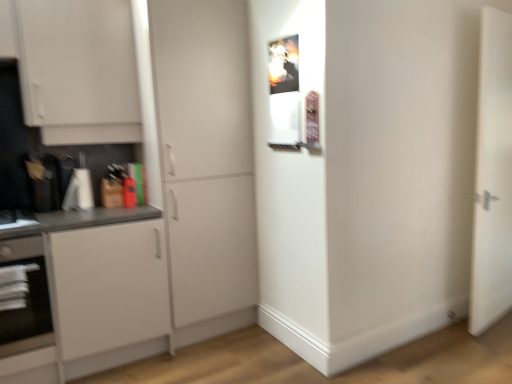
Describe the element at coordinates (493, 176) in the screenshot. I see `white matte door at right, arranged as the first door when viewed from the right` at that location.

This screenshot has width=512, height=384. Describe the element at coordinates (101, 284) in the screenshot. I see `white matte cabinet at left` at that location.

How much space does white matte cabinet at center, marked as the 1th door in a left-to-right arrangement, occupy vertically?

white matte cabinet at center, marked as the 1th door in a left-to-right arrangement, is 2.13 meters in height.

Measure the distance between black glass oven at lower left and camera.

black glass oven at lower left and camera are 2.03 meters apart.

Image resolution: width=512 pixels, height=384 pixels. Find the location of `white matte door at right, arranged as the first door when viewed from the right`. white matte door at right, arranged as the first door when viewed from the right is located at coordinates (493, 176).

Is white matte cabinet at center, marked as the 1th door in a left-to-right arrangement, completely or partially outside of white matte cabinet at left?

Indeed, white matte cabinet at center, marked as the 1th door in a left-to-right arrangement, is completely outside white matte cabinet at left.

From their relative heights in the image, would you say white matte cabinet at center, marked as the 1th door in a left-to-right arrangement, is taller or shorter than white matte cabinet at left?

Clearly, white matte cabinet at center, marked as the 1th door in a left-to-right arrangement, is taller compared to white matte cabinet at left.

Is white matte cabinet at center, arranged as the 2th door when viewed from the right, aimed at white matte cabinet at left?

No, white matte cabinet at center, arranged as the 2th door when viewed from the right, is not aimed at white matte cabinet at left.

What's the angular difference between white matte cabinet at center, arranged as the 2th door when viewed from the right, and white matte cabinet at left's facing directions?

2.32 degrees.

Is white matte cabinet at left at the left side of white matte door at right, which appears as the 2th door when viewed from the left?

Yes.

Does white matte cabinet at left have a smaller size compared to white matte door at right, which appears as the 2th door when viewed from the left?

No, white matte cabinet at left is not smaller than white matte door at right, which appears as the 2th door when viewed from the left.

From the picture: Is white matte cabinet at left positioned with its back to white matte door at right, which appears as the 2th door when viewed from the left?

white matte cabinet at left does not have its back to white matte door at right, which appears as the 2th door when viewed from the left.

From a real-world perspective, is white matte cabinet at left on white matte door at right, arranged as the first door when viewed from the right?

Incorrect, from a real-world perspective, white matte cabinet at left is lower than white matte door at right, arranged as the first door when viewed from the right.

Can you confirm if white matte cabinet at left is bigger than black glass oven at lower left?

Correct, white matte cabinet at left is larger in size than black glass oven at lower left.

Locate an element on the screen. cabinetry that appears below the black glass oven at lower left (from the image's perspective) is located at coordinates (101, 284).

Is white matte cabinet at left surrounding black glass oven at lower left?

Yes, white matte cabinet at left is surrounding black glass oven at lower left.

Based on their sizes in the image, would you say white matte cabinet at center, marked as the 1th door in a left-to-right arrangement, is bigger or smaller than black glass oven at lower left?

white matte cabinet at center, marked as the 1th door in a left-to-right arrangement, is bigger than black glass oven at lower left.

How many degrees apart are the facing directions of white matte cabinet at center, marked as the 1th door in a left-to-right arrangement, and black glass oven at lower left?

The angle between the facing direction of white matte cabinet at center, marked as the 1th door in a left-to-right arrangement, and the facing direction of black glass oven at lower left is 2.32 degrees.

Considering the positions of objects white matte cabinet at center, arranged as the 2th door when viewed from the right, and black glass oven at lower left in the image provided, who is more to the left, white matte cabinet at center, arranged as the 2th door when viewed from the right, or black glass oven at lower left?

Positioned to the left is black glass oven at lower left.

From the image's perspective, which object appears higher, white matte cabinet at center, arranged as the 2th door when viewed from the right, or black glass oven at lower left?

white matte cabinet at center, arranged as the 2th door when viewed from the right, is shown above in the image.

Can you tell me how much white matte cabinet at left and white matte cabinet at center, arranged as the 2th door when viewed from the right, differ in facing direction?

The angular difference between white matte cabinet at left and white matte cabinet at center, arranged as the 2th door when viewed from the right, is 2.32 degrees.

Between white matte cabinet at left and white matte cabinet at center, marked as the 1th door in a left-to-right arrangement, which one is positioned behind?

white matte cabinet at center, marked as the 1th door in a left-to-right arrangement, is further away from the camera.

Is white matte cabinet at left not within white matte cabinet at center, arranged as the 2th door when viewed from the right?

That's correct, white matte cabinet at left is outside of white matte cabinet at center, arranged as the 2th door when viewed from the right.

Considering the sizes of objects white matte door at right, arranged as the first door when viewed from the right, and white matte cabinet at center, arranged as the 2th door when viewed from the right, in the image provided, who is taller, white matte door at right, arranged as the first door when viewed from the right, or white matte cabinet at center, arranged as the 2th door when viewed from the right,?

white matte cabinet at center, arranged as the 2th door when viewed from the right.

From the image's perspective, which one is positioned lower, white matte door at right, which appears as the 2th door when viewed from the left, or white matte cabinet at center, arranged as the 2th door when viewed from the right?

white matte door at right, which appears as the 2th door when viewed from the left.

Would you say white matte door at right, arranged as the first door when viewed from the right, is outside white matte cabinet at center, arranged as the 2th door when viewed from the right?

white matte door at right, arranged as the first door when viewed from the right, lies outside white matte cabinet at center, arranged as the 2th door when viewed from the right,'s area.

Can you confirm if white matte door at right, arranged as the first door when viewed from the right, is smaller than white matte cabinet at center, arranged as the 2th door when viewed from the right?

Yes.

From the image's perspective, which is above, black glass oven at lower left or white matte door at right, arranged as the first door when viewed from the right?

From the image's view, white matte door at right, arranged as the first door when viewed from the right, is above.

Which is in front, point (48, 299) or point (509, 272)?

The point (48, 299) is more forward.

In the scene shown: Considering the sizes of black glass oven at lower left and white matte door at right, which appears as the 2th door when viewed from the left, in the image, is black glass oven at lower left taller or shorter than white matte door at right, which appears as the 2th door when viewed from the left,?

In the image, black glass oven at lower left appears to be shorter than white matte door at right, which appears as the 2th door when viewed from the left.

Based on the photo, which of these two, black glass oven at lower left or white matte door at right, arranged as the first door when viewed from the right, is wider?

With larger width is black glass oven at lower left.

What are the coordinates of `cabinetry that is on the left side of white matte cabinet at center, arranged as the 2th door when viewed from the right` in the screenshot? It's located at (101, 284).

From the image's perspective, starting from the white matte cabinet at left, which door is the 1st one above? Please provide its 2D coordinates.

[(493, 176)]

Estimate the real-world distances between objects in this image. Which object is closer to black glass oven at lower left, white matte cabinet at center, marked as the 1th door in a left-to-right arrangement, or white matte cabinet at left?

Based on the image, white matte cabinet at left appears to be nearer to black glass oven at lower left.

Looking at the image, which one is located closer to black glass oven at lower left, white matte cabinet at center, marked as the 1th door in a left-to-right arrangement, or white matte door at right, arranged as the first door when viewed from the right?

The object closer to black glass oven at lower left is white matte cabinet at center, marked as the 1th door in a left-to-right arrangement.

Based on their spatial positions, is black glass oven at lower left or white matte door at right, arranged as the first door when viewed from the right, closer to white matte cabinet at left?

The object closer to white matte cabinet at left is black glass oven at lower left.

When comparing their distances from white matte cabinet at left, does white matte cabinet at center, marked as the 1th door in a left-to-right arrangement, or black glass oven at lower left seem further?

white matte cabinet at center, marked as the 1th door in a left-to-right arrangement, is positioned further to the anchor white matte cabinet at left.

From the image, which object appears to be farther from white matte cabinet at center, arranged as the 2th door when viewed from the right, white matte door at right, arranged as the first door when viewed from the right, or black glass oven at lower left?

Based on the image, white matte door at right, arranged as the first door when viewed from the right, appears to be further to white matte cabinet at center, arranged as the 2th door when viewed from the right.

Looking at this image, when comparing their distances from white matte cabinet at center, marked as the 1th door in a left-to-right arrangement, does white matte door at right, which appears as the 2th door when viewed from the left, or white matte cabinet at left seem further?

white matte door at right, which appears as the 2th door when viewed from the left, lies further to white matte cabinet at center, marked as the 1th door in a left-to-right arrangement, than the other object.

When comparing their distances from white matte door at right, arranged as the first door when viewed from the right, does white matte cabinet at center, arranged as the 2th door when viewed from the right, or black glass oven at lower left seem closer?

The object closer to white matte door at right, arranged as the first door when viewed from the right, is white matte cabinet at center, arranged as the 2th door when viewed from the right.

In the scene shown: Which object lies nearer to the anchor point white matte cabinet at center, arranged as the 2th door when viewed from the right, black glass oven at lower left or white matte door at right, which appears as the 2th door when viewed from the left?

The object closer to white matte cabinet at center, arranged as the 2th door when viewed from the right, is black glass oven at lower left.

You are a GUI agent. You are given a task and a screenshot of the screen. Output one action in this format:
    pyautogui.click(x=<x>, y=<y>)
    Task: Click on the door located between white matte cabinet at left and white matte door at right, which appears as the 2th door when viewed from the left, in the left-right direction
    This screenshot has width=512, height=384.
    Given the screenshot: What is the action you would take?
    pyautogui.click(x=205, y=154)

At what (x,y) coordinates should I click in order to perform the action: click on cabinetry between black glass oven at lower left and white matte cabinet at center, marked as the 1th door in a left-to-right arrangement, in the horizontal direction. Please return your answer as a coordinate pair (x, y). The image size is (512, 384). Looking at the image, I should click on (101, 284).

Find the location of a particular element. cabinetry between black glass oven at lower left and white matte door at right, arranged as the first door when viewed from the right is located at coordinates (101, 284).

Locate an element on the screen. The height and width of the screenshot is (384, 512). door between black glass oven at lower left and white matte door at right, arranged as the first door when viewed from the right, from left to right is located at coordinates click(x=205, y=154).